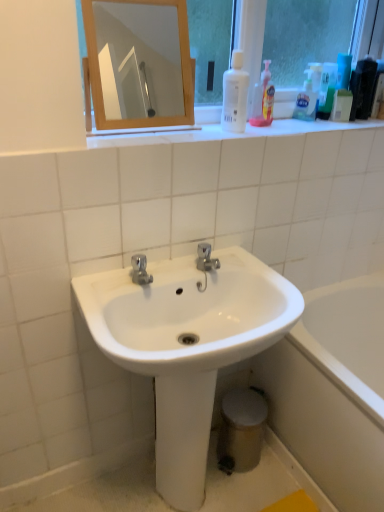
Question: Is white glossy bathtub at lower right taller or shorter than translucent plastic soap dispenser at upper right, which ranks as the 3th cleaning product in left-to-right order?

Choices:
 (A) tall
 (B) short

Answer: (A)

Question: Is white glossy bathtub at lower right to the left or to the right of translucent plastic soap dispenser at upper right, the first cleaning product viewed from the right, in the image?

Choices:
 (A) left
 (B) right

Answer: (B)

Question: Which is farther from the translucent plastic bottle at upper right, which is the 2th cleaning product from left to right?

Choices:
 (A) white glossy bathtub at lower right
 (B) white glossy bottle at upper center, which is the first cleaning product in left-to-right order
 (C) wooden mirror at upper center
 (D) translucent plastic soap dispenser at upper right, the first cleaning product viewed from the right
 (E) white glossy sink at center

Answer: (C)

Question: Estimate the real-world distances between objects in this image. Which object is closer to the white glossy bathtub at lower right?

Choices:
 (A) white glossy sink at center
 (B) translucent plastic bottle at upper right, which is the 2th cleaning product from right to left
 (C) white glossy bottle at upper center, which is the first cleaning product in left-to-right order
 (D) wooden mirror at upper center
 (E) translucent plastic soap dispenser at upper right, which ranks as the 3th cleaning product in left-to-right order

Answer: (A)